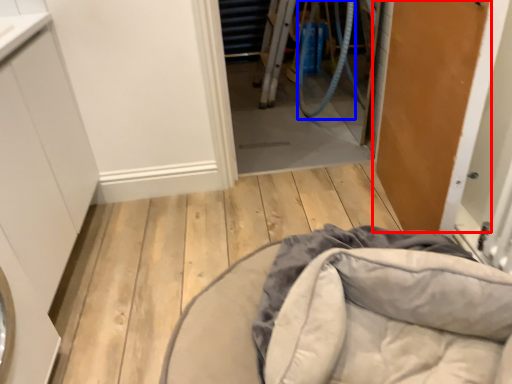
Question: Which object appears closest to the camera in this image, door (highlighted by a red box) or garden hose (highlighted by a blue box)?

Choices:
 (A) door
 (B) garden hose

Answer: (A)